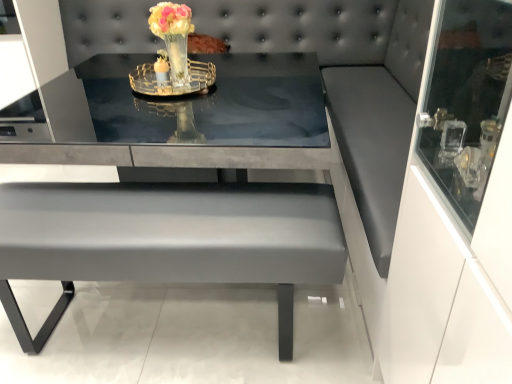
Question: From the image's perspective, is matte gray table at center located above or below translucent glass vase at center?

Choices:
 (A) above
 (B) below

Answer: (B)

Question: Considering the positions of matte gray table at center and translucent glass vase at center in the image, is matte gray table at center bigger or smaller than translucent glass vase at center?

Choices:
 (A) small
 (B) big

Answer: (B)

Question: Is matte gray table at center taller or shorter than translucent glass vase at center?

Choices:
 (A) short
 (B) tall

Answer: (B)

Question: In terms of height, does translucent glass vase at center look taller or shorter compared to matte gray table at center?

Choices:
 (A) tall
 (B) short

Answer: (B)

Question: Considering the positions of point (152, 23) and point (164, 221), is point (152, 23) closer or farther from the camera than point (164, 221)?

Choices:
 (A) farther
 (B) closer

Answer: (A)

Question: Is translucent glass vase at center bigger or smaller than matte gray table at center?

Choices:
 (A) small
 (B) big

Answer: (A)

Question: Looking at their shapes, would you say translucent glass vase at center is wider or thinner than matte gray table at center?

Choices:
 (A) thin
 (B) wide

Answer: (A)